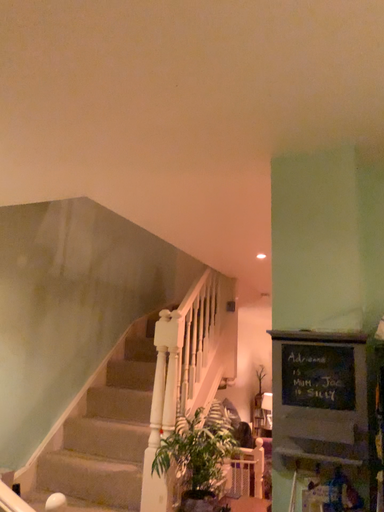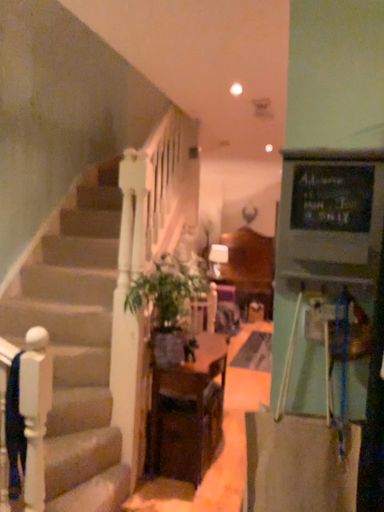
Question: Which way did the camera rotate in the video?

Choices:
 (A) rotated upward
 (B) rotated downward

Answer: (B)